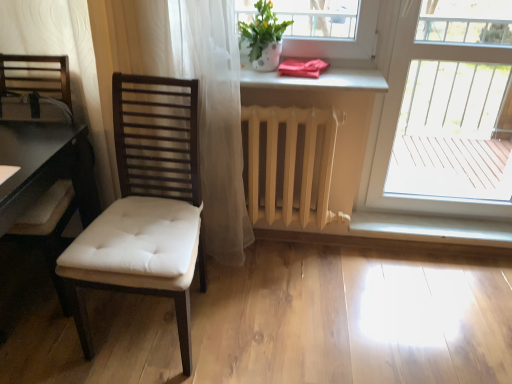
In order to click on vacant space underneath matte white cushioned chair at left (from a real-world perspective) in this screenshot , I will do `click(155, 326)`.